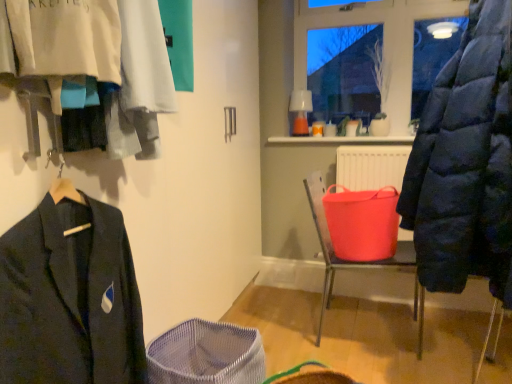
Question: From the image's perspective, does mesh fabric basket at lower center appear higher than transparent glass window at upper center?

Choices:
 (A) yes
 (B) no

Answer: (B)

Question: Would you say mesh fabric basket at lower center is a long distance from transparent glass window at upper center?

Choices:
 (A) no
 (B) yes

Answer: (B)

Question: Is mesh fabric basket at lower center closer to the viewer compared to transparent glass window at upper center?

Choices:
 (A) yes
 (B) no

Answer: (A)

Question: Does mesh fabric basket at lower center have a smaller size compared to transparent glass window at upper center?

Choices:
 (A) yes
 (B) no

Answer: (A)

Question: Is mesh fabric basket at lower center thinner than transparent glass window at upper center?

Choices:
 (A) no
 (B) yes

Answer: (A)

Question: Is mesh fabric basket at lower center at the left side of transparent glass window at upper center?

Choices:
 (A) no
 (B) yes

Answer: (B)

Question: Is rubberized plastic bucket at center far away from matte blue puffer coat at right?

Choices:
 (A) no
 (B) yes

Answer: (A)

Question: From the image's perspective, would you say rubberized plastic bucket at center is positioned over matte blue puffer coat at right?

Choices:
 (A) no
 (B) yes

Answer: (A)

Question: Is rubberized plastic bucket at center turned away from matte blue puffer coat at right?

Choices:
 (A) no
 (B) yes

Answer: (A)

Question: Is the position of rubberized plastic bucket at center more distant than that of matte blue puffer coat at right?

Choices:
 (A) yes
 (B) no

Answer: (A)

Question: Is the surface of rubberized plastic bucket at center in direct contact with matte blue puffer coat at right?

Choices:
 (A) yes
 (B) no

Answer: (B)

Question: Does rubberized plastic bucket at center have a lesser width compared to matte blue puffer coat at right?

Choices:
 (A) no
 (B) yes

Answer: (B)

Question: Considering the relative sizes of rubberized plastic bucket at center and matte black jacket at left in the image provided, is rubberized plastic bucket at center bigger than matte black jacket at left?

Choices:
 (A) no
 (B) yes

Answer: (A)